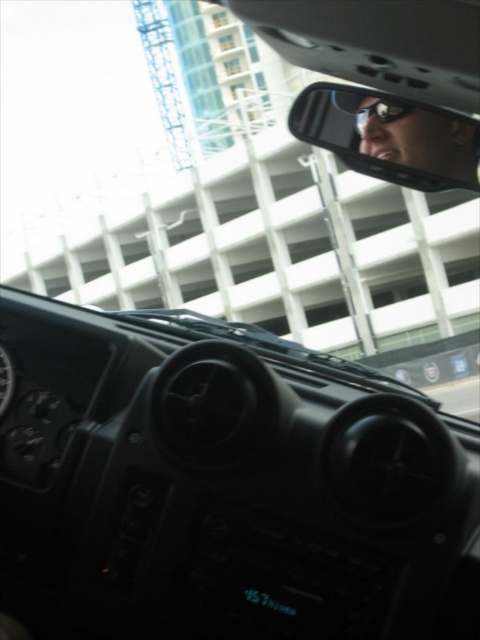
Question: Which point appears closest to the camera in this image?

Choices:
 (A) click(x=404, y=99)
 (B) click(x=396, y=113)

Answer: (A)

Question: Does clear plastic rearview mirror at upper center come in front of matte black goggles at upper center?

Choices:
 (A) yes
 (B) no

Answer: (A)

Question: Considering the relative positions of clear plastic rearview mirror at upper center and matte black goggles at upper center in the image provided, where is clear plastic rearview mirror at upper center located with respect to matte black goggles at upper center?

Choices:
 (A) right
 (B) left

Answer: (B)

Question: Can you confirm if clear plastic rearview mirror at upper center is bigger than matte black goggles at upper center?

Choices:
 (A) no
 (B) yes

Answer: (B)

Question: Which object appears closest to the camera in this image?

Choices:
 (A) matte black goggles at upper center
 (B) clear plastic rearview mirror at upper center

Answer: (B)

Question: Which object appears farthest from the camera in this image?

Choices:
 (A) clear plastic rearview mirror at upper center
 (B) matte black goggles at upper center

Answer: (B)